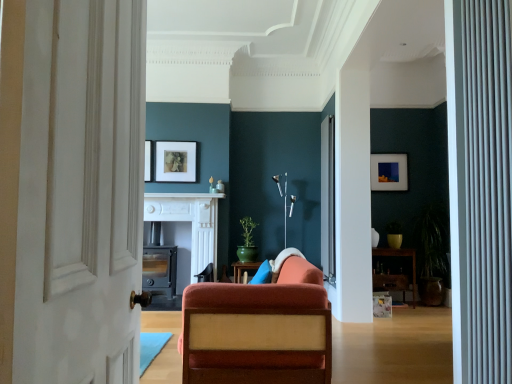
Find the location of a particular element. green matte plant at right, arranged as the second houseplant when viewed from the left is located at coordinates (431, 254).

What do you see at coordinates (247, 241) in the screenshot?
I see `green matte pot at center, which is counted as the first houseplant, starting from the left` at bounding box center [247, 241].

What are the coordinates of `matte blue picture frame at upper right, which appears as the second picture frame when viewed from the left` in the screenshot? It's located at (389, 172).

This screenshot has width=512, height=384. Describe the element at coordinates (263, 273) in the screenshot. I see `blue fabric pillow at center` at that location.

This screenshot has height=384, width=512. I want to click on white marble fireplace at center, so click(185, 195).

What do you see at coordinates (176, 161) in the screenshot?
I see `matte white picture frame at upper center, which ranks as the 2th picture frame in right-to-left order` at bounding box center [176, 161].

Find the location of a particular element. green matte plant at right, the 1th houseplant positioned from the right is located at coordinates (431, 254).

Is matte gray fireplace at center, placed as the first fireplace when sorted from right to left, not inside matte black wood-burning stove at center, acting as the 1th fireplace starting from the left?

Yes, matte gray fireplace at center, placed as the first fireplace when sorted from right to left, is located beyond the bounds of matte black wood-burning stove at center, acting as the 1th fireplace starting from the left.

From the picture: Which is farther from the camera, (184, 199) or (151, 282)?

The point (184, 199) is behind.

Where is `fireplace on the left of matte gray fireplace at center, arranged as the 2th fireplace when viewed from the left`? fireplace on the left of matte gray fireplace at center, arranged as the 2th fireplace when viewed from the left is located at coordinates (160, 269).

From a real-world perspective, is matte gray fireplace at center, placed as the first fireplace when sorted from right to left, physically above matte black wood-burning stove at center, acting as the 1th fireplace starting from the left?

Yes, from a real-world perspective, matte gray fireplace at center, placed as the first fireplace when sorted from right to left, is on top of matte black wood-burning stove at center, acting as the 1th fireplace starting from the left.

Considering their positions, is white textured door at left located in front of or behind matte black wood-burning stove at center, acting as the 1th fireplace starting from the left?

Visually, white textured door at left is located in front of matte black wood-burning stove at center, acting as the 1th fireplace starting from the left.

Between white textured door at left and matte black wood-burning stove at center, acting as the 1th fireplace starting from the left, which one has larger width?

With larger width is matte black wood-burning stove at center, acting as the 1th fireplace starting from the left.

Looking at this image, from a real-world perspective, which is physically below, white textured door at left or matte black wood-burning stove at center, acting as the 1th fireplace starting from the left?

matte black wood-burning stove at center, acting as the 1th fireplace starting from the left, is physically lower.

Which of these two, white textured door at left or matte black wood-burning stove at center, acting as the 1th fireplace starting from the left, stands taller?

Standing taller between the two is white textured door at left.

Are blue fabric pillow at center and silver metallic floor lamp at center far apart?

Absolutely, blue fabric pillow at center is distant from silver metallic floor lamp at center.

Considering the relative sizes of blue fabric pillow at center and silver metallic floor lamp at center in the image provided, is blue fabric pillow at center shorter than silver metallic floor lamp at center?

Yes, blue fabric pillow at center is shorter than silver metallic floor lamp at center.

You are a GUI agent. You are given a task and a screenshot of the screen. Output one action in this format:
    pyautogui.click(x=<x>, y=<y>)
    Task: Click on the pillow lying on the left of silver metallic floor lamp at center
    This screenshot has width=512, height=384.
    Given the screenshot: What is the action you would take?
    pyautogui.click(x=263, y=273)

Looking at this image, what's the angular difference between green matte pot at center, marked as the 2th houseplant in a right-to-left arrangement, and wooden shelf at right's facing directions?

The angle between the facing direction of green matte pot at center, marked as the 2th houseplant in a right-to-left arrangement, and the facing direction of wooden shelf at right is 0.152 degrees.

From the image's perspective, would you say green matte pot at center, marked as the 2th houseplant in a right-to-left arrangement, is shown under wooden shelf at right?

No, from the image's perspective, green matte pot at center, marked as the 2th houseplant in a right-to-left arrangement, is not beneath wooden shelf at right.

In the scene shown: Is green matte pot at center, which is counted as the first houseplant, starting from the left, looking in the opposite direction of wooden shelf at right?

No.

Which object is positioned more to the right, green matte pot at center, which is counted as the first houseplant, starting from the left, or wooden shelf at right?

wooden shelf at right is more to the right.

Is green matte plant at right, the 1th houseplant positioned from the right, placed right next to silver metallic floor lamp at center?

green matte plant at right, the 1th houseplant positioned from the right, and silver metallic floor lamp at center are not in contact.

Does green matte plant at right, arranged as the second houseplant when viewed from the left, turn towards silver metallic floor lamp at center?

No, green matte plant at right, arranged as the second houseplant when viewed from the left, is not facing towards silver metallic floor lamp at center.

Does green matte plant at right, the 1th houseplant positioned from the right, appear on the right side of silver metallic floor lamp at center?

Yes.

Between green matte plant at right, arranged as the second houseplant when viewed from the left, and silver metallic floor lamp at center, which one has smaller size?

Smaller between the two is silver metallic floor lamp at center.

Is point (190, 165) less distant than point (245, 226)?

No, (190, 165) is behind (245, 226).

Looking at this image, from the image's perspective, which one is positioned higher, matte white picture frame at upper center, which appears as the first picture frame when viewed from the front, or green matte pot at center, marked as the 2th houseplant in a right-to-left arrangement?

matte white picture frame at upper center, which appears as the first picture frame when viewed from the front, appears higher in the image.

The image size is (512, 384). There is a matte white picture frame at upper center, which ranks as the 2th picture frame in right-to-left order. Find the location of `the 1st houseplant below it (from the image's perspective)`. the 1st houseplant below it (from the image's perspective) is located at coordinates (247, 241).

I want to click on door that is on the left side of matte blue picture frame at upper right, the 1th picture frame in the right-to-left sequence, so click(x=71, y=189).

Considering the sizes of objects white textured door at left and matte blue picture frame at upper right, the first picture frame when ordered from back to front, in the image provided, who is taller, white textured door at left or matte blue picture frame at upper right, the first picture frame when ordered from back to front,?

With more height is white textured door at left.

Between white textured door at left and matte blue picture frame at upper right, which appears as the second picture frame when viewed from the left, which one has smaller width?

With smaller width is matte blue picture frame at upper right, which appears as the second picture frame when viewed from the left.

From the picture: Would you say white textured door at left is outside matte blue picture frame at upper right, the 1th picture frame in the right-to-left sequence?

Yes, white textured door at left is not within matte blue picture frame at upper right, the 1th picture frame in the right-to-left sequence.

Where is `fireplace in front of the matte black wood-burning stove at center, acting as the 1th fireplace starting from the left`? The height and width of the screenshot is (384, 512). fireplace in front of the matte black wood-burning stove at center, acting as the 1th fireplace starting from the left is located at coordinates (189, 221).

Locate an element on the screen. This screenshot has width=512, height=384. fireplace that is the 2nd object to the left of the white textured door at left, starting at the anchor is located at coordinates (160, 269).

Estimate the real-world distances between objects in this image. Which object is closer to matte black wood-burning stove at center, the 2th fireplace positioned from the right, velvet orange chair at center or green matte plant at right, arranged as the second houseplant when viewed from the left?

velvet orange chair at center is positioned closer to the anchor matte black wood-burning stove at center, the 2th fireplace positioned from the right.

Looking at the image, which one is located closer to matte blue picture frame at upper right, which appears as the second picture frame when viewed from the left, velvet orange chair at center or matte white picture frame at upper center, the second picture frame in the back-to-front sequence?

matte white picture frame at upper center, the second picture frame in the back-to-front sequence.

Which object lies nearer to the anchor point matte black wood-burning stove at center, acting as the 1th fireplace starting from the left, matte gray fireplace at center, placed as the first fireplace when sorted from right to left, or white textured door at left?

Based on the image, matte gray fireplace at center, placed as the first fireplace when sorted from right to left, appears to be nearer to matte black wood-burning stove at center, acting as the 1th fireplace starting from the left.

Estimate the real-world distances between objects in this image. Which object is further from matte white picture frame at upper center, the first picture frame positioned from the left, white textured curtain at right or white textured door at left?

Based on the image, white textured curtain at right appears to be further to matte white picture frame at upper center, the first picture frame positioned from the left.

When comparing their distances from velvet orange chair at center, does green matte pot at center, which is counted as the first houseplant, starting from the left, or white marble fireplace at center seem closer?

The object closer to velvet orange chair at center is green matte pot at center, which is counted as the first houseplant, starting from the left.

Based on their spatial positions, is matte gray fireplace at center, placed as the first fireplace when sorted from right to left, or green matte pot at center, marked as the 2th houseplant in a right-to-left arrangement, closer to blue fabric pillow at center?

matte gray fireplace at center, placed as the first fireplace when sorted from right to left, is closer to blue fabric pillow at center.

Estimate the real-world distances between objects in this image. Which object is further from green matte plant at right, arranged as the second houseplant when viewed from the left, white marble fireplace at center or green matte pot at center, marked as the 2th houseplant in a right-to-left arrangement?

white marble fireplace at center lies further to green matte plant at right, arranged as the second houseplant when viewed from the left, than the other object.

Based on their spatial positions, is silver metallic floor lamp at center or white textured door at left closer to wooden shelf at right?

silver metallic floor lamp at center.

Find the location of a particular element. The width and height of the screenshot is (512, 384). mantle positioned between white textured curtain at right and matte black wood-burning stove at center, acting as the 1th fireplace starting from the left, from near to far is located at coordinates (185, 195).

This screenshot has width=512, height=384. What are the coordinates of `fireplace between matte white picture frame at upper center, which appears as the first picture frame when viewed from the front, and green matte plant at right, arranged as the second houseplant when viewed from the left, from left to right` in the screenshot? It's located at (189, 221).

Where is `screen door between blue fabric pillow at center and green matte plant at right, the 1th houseplant positioned from the right, from left to right`? screen door between blue fabric pillow at center and green matte plant at right, the 1th houseplant positioned from the right, from left to right is located at coordinates (328, 198).

In order to click on furniture between matte gray fireplace at center, placed as the first fireplace when sorted from right to left, and green matte plant at right, arranged as the second houseplant when viewed from the left, from left to right in this screenshot , I will do `click(400, 256)`.